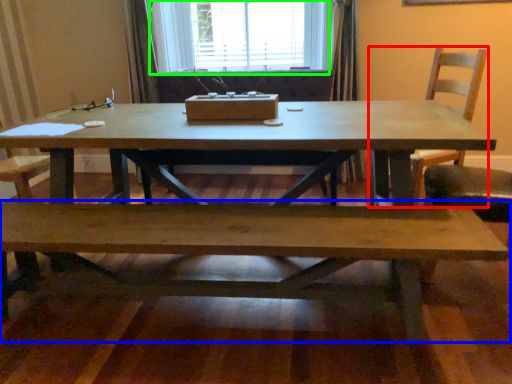
Question: Which object is the closest to the chair (highlighted by a red box)? Choose among these: bench (highlighted by a blue box) or window (highlighted by a green box).

Choices:
 (A) bench
 (B) window

Answer: (A)